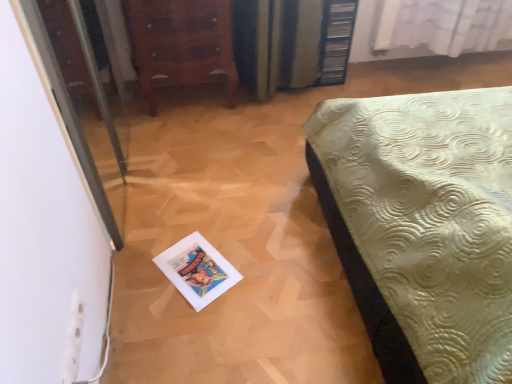
Question: From the image's perspective, does wooden chest of drawers at upper left appear higher than transparent glass screen door at left?

Choices:
 (A) no
 (B) yes

Answer: (B)

Question: Is wooden chest of drawers at upper left far from transparent glass screen door at left?

Choices:
 (A) yes
 (B) no

Answer: (B)

Question: Can you confirm if wooden chest of drawers at upper left is smaller than transparent glass screen door at left?

Choices:
 (A) no
 (B) yes

Answer: (A)

Question: Is wooden chest of drawers at upper left to the right of transparent glass screen door at left from the viewer's perspective?

Choices:
 (A) no
 (B) yes

Answer: (B)

Question: Can you see wooden chest of drawers at upper left touching transparent glass screen door at left?

Choices:
 (A) no
 (B) yes

Answer: (A)

Question: Is transparent glass screen door at left to the left or to the right of wooden chest of drawers at upper left in the image?

Choices:
 (A) right
 (B) left

Answer: (B)

Question: Is point (37, 49) positioned closer to the camera than point (222, 9)?

Choices:
 (A) closer
 (B) farther

Answer: (A)

Question: Based on their sizes in the image, would you say transparent glass screen door at left is bigger or smaller than wooden chest of drawers at upper left?

Choices:
 (A) small
 (B) big

Answer: (A)

Question: In the image, is transparent glass screen door at left positioned in front of or behind wooden chest of drawers at upper left?

Choices:
 (A) behind
 (B) front

Answer: (B)

Question: Is white sheer curtain at upper right wider or thinner than transparent glass screen door at left?

Choices:
 (A) thin
 (B) wide

Answer: (B)

Question: Which is correct: white sheer curtain at upper right is inside transparent glass screen door at left, or outside of it?

Choices:
 (A) outside
 (B) inside

Answer: (A)

Question: Considering the relative positions of white sheer curtain at upper right and transparent glass screen door at left in the image provided, is white sheer curtain at upper right to the left or to the right of transparent glass screen door at left?

Choices:
 (A) right
 (B) left

Answer: (A)

Question: Considering the positions of point tap(492, 48) and point tap(90, 72), is point tap(492, 48) closer or farther from the camera than point tap(90, 72)?

Choices:
 (A) farther
 (B) closer

Answer: (A)

Question: From a real-world perspective, is transparent glass screen door at left physically located above or below white sheer curtain at upper right?

Choices:
 (A) above
 (B) below

Answer: (A)

Question: From the image's perspective, is transparent glass screen door at left positioned above or below white sheer curtain at upper right?

Choices:
 (A) above
 (B) below

Answer: (B)